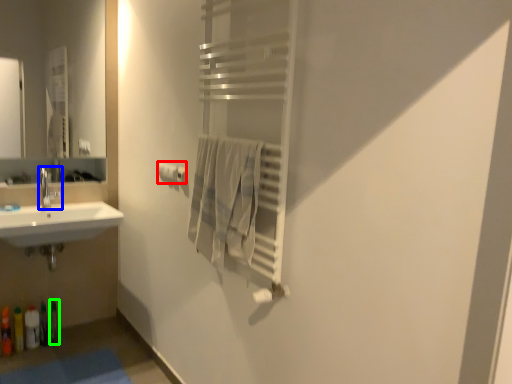
Question: Considering the real-world distances, which object is closest to toilet paper (highlighted by a red box)? tap (highlighted by a blue box) or toiletry (highlighted by a green box).

Choices:
 (A) tap
 (B) toiletry

Answer: (A)